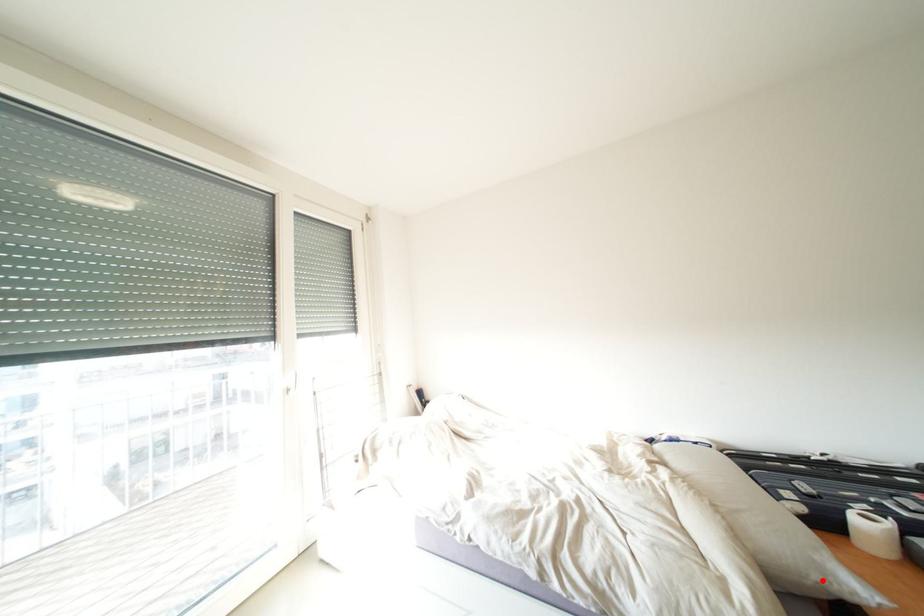
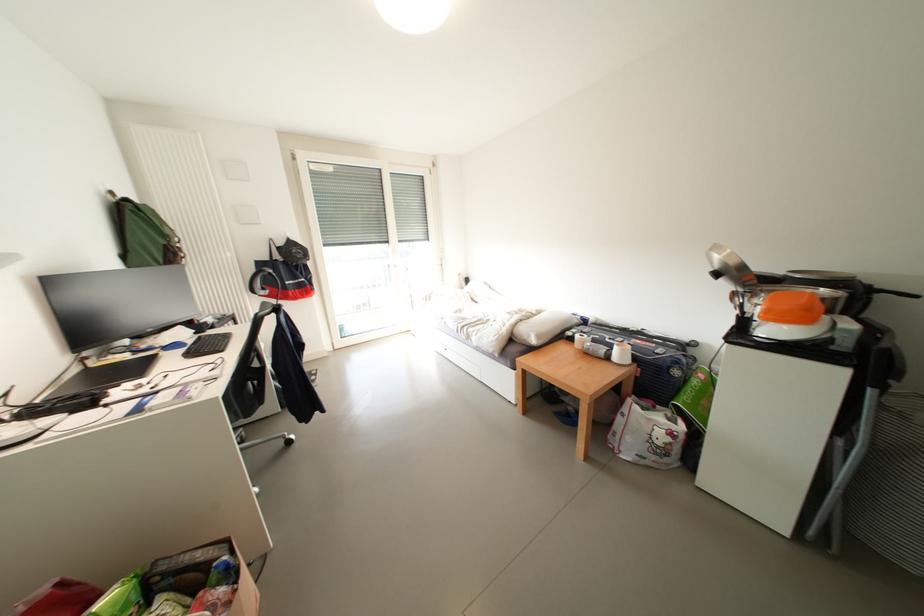
Question: I am providing you with two images of the same scene from different viewpoints. A red point is marked on the first image. Can you still see the location of the red point in image 2?

Choices:
 (A) Yes
 (B) No

Answer: (A)